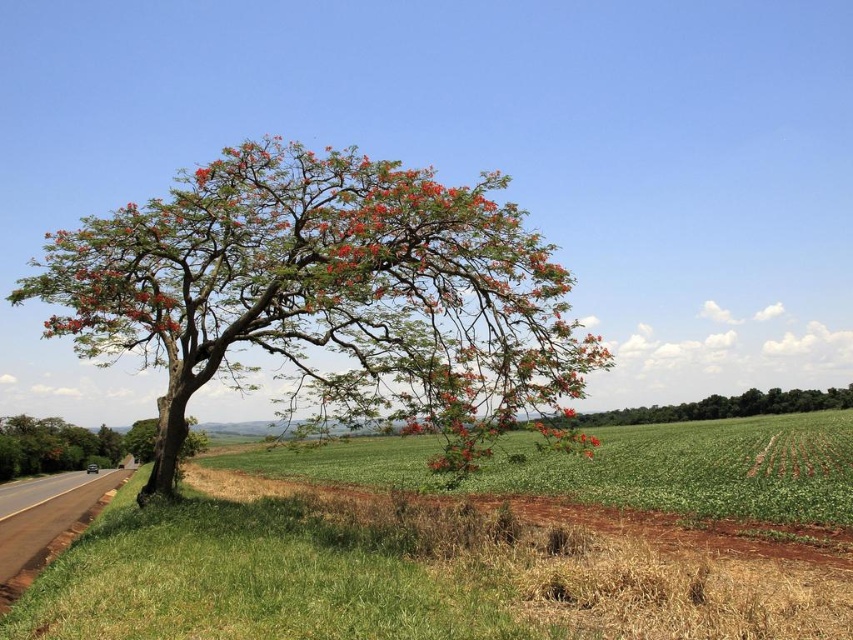
Question: Which is nearer to the asphalt road at lower left?

Choices:
 (A) green grassy field at lower center
 (B) green leafy tree at left

Answer: (A)

Question: Which point appears closest to the camera in this image?

Choices:
 (A) (84, 456)
 (B) (55, 529)
 (C) (120, 612)

Answer: (C)

Question: Can you confirm if green grassy field at lower center is smaller than asphalt road at lower left?

Choices:
 (A) no
 (B) yes

Answer: (A)

Question: Is green grassy field at lower center smaller than asphalt road at lower left?

Choices:
 (A) yes
 (B) no

Answer: (B)

Question: Does green grassy field at lower center appear under green leafy tree at left?

Choices:
 (A) yes
 (B) no

Answer: (B)

Question: Which object is farther from the camera taking this photo?

Choices:
 (A) green grassy field at lower center
 (B) green leafy tree at left

Answer: (B)